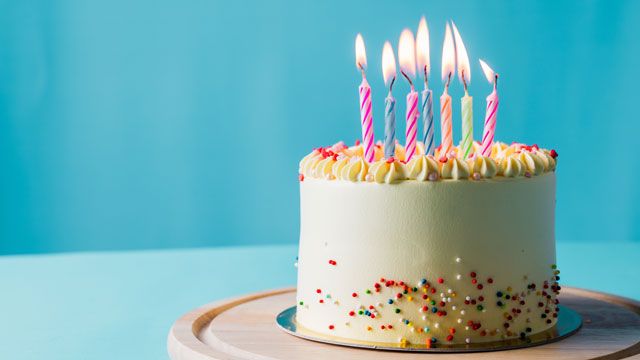
Locate an element on the screen. The height and width of the screenshot is (360, 640). candles is located at coordinates (365, 126), (392, 132), (413, 135), (431, 135), (454, 136), (470, 136), (496, 138).